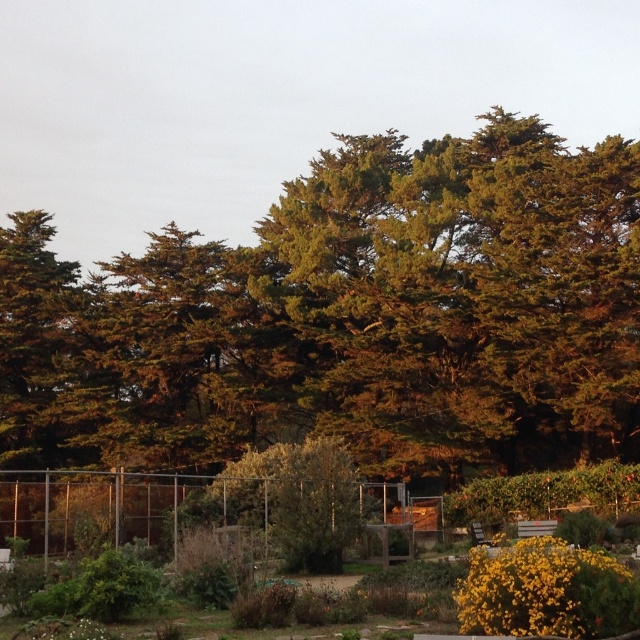
You are standing at the origin point of the coordinate system in this garden scene. The green leafy bush at center is located at coordinates point 0.925, 0.855. If you want to walk directly towards the bush, which direction should you move in?

The green leafy bush at center is located at coordinates point (547, 592), so you should move towards the direction of increasing x and y coordinates to reach it.

You are a gardener planning to plant a new flower bed between the green textured tree at center and the green leafy bush at center. Considering their sizes, which one might require more space to accommodate its growth?

The green textured tree at center is larger in size than the green leafy bush at center, so it would require more space to accommodate its growth.